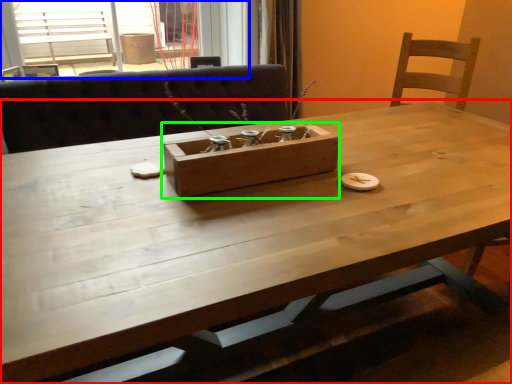
Question: Which object is the closest to the table (highlighted by a red box)? Choose among these: window (highlighted by a blue box) or cardboard box (highlighted by a green box).

Choices:
 (A) window
 (B) cardboard box

Answer: (B)